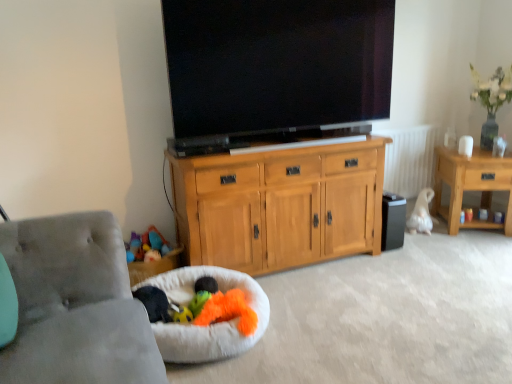
Identify the location of space that is in front of white fluffy dog at right. (424, 239).